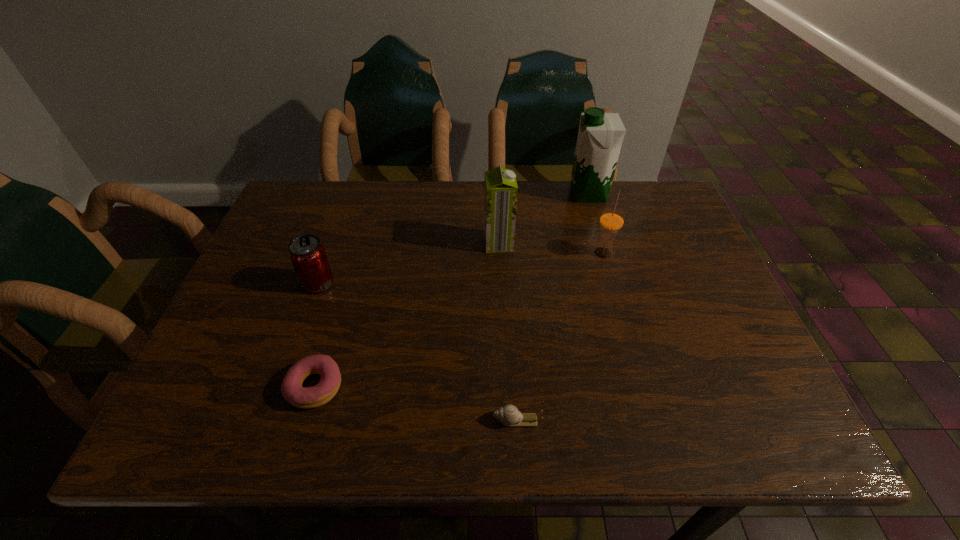
Locate an element on the screen. The image size is (960, 540). object that is the third closest to the doughnut is located at coordinates (500, 187).

Where is `vacant point that satisfies the following two spatial constraints: 1. on the back side of the fourth tallest object; 2. on the left side of the shorter soya milk`? The image size is (960, 540). vacant point that satisfies the following two spatial constraints: 1. on the back side of the fourth tallest object; 2. on the left side of the shorter soya milk is located at coordinates (333, 244).

This screenshot has height=540, width=960. In order to click on vacant space that satisfies the following two spatial constraints: 1. on the back side of the fourth farthest object; 2. on the right side of the straw in this screenshot , I will do `click(329, 252)`.